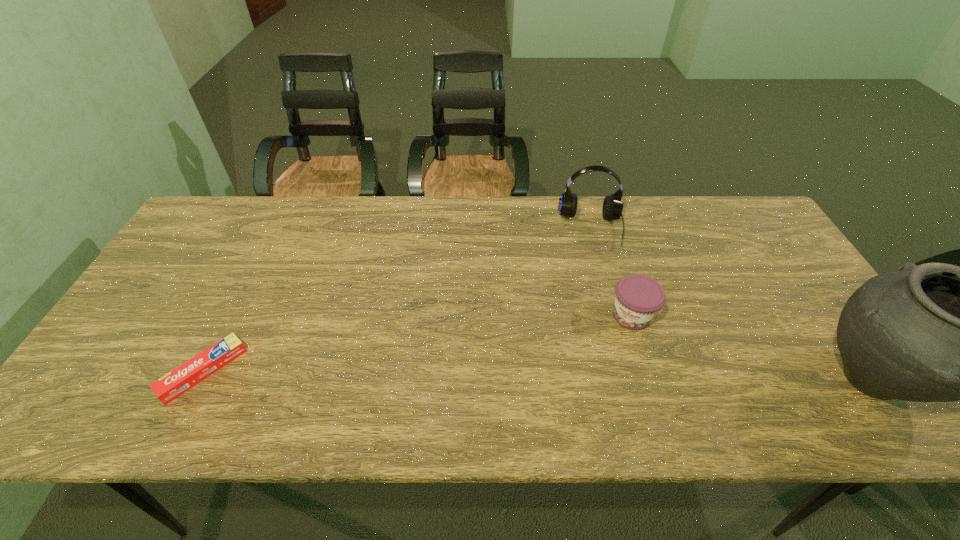
This screenshot has height=540, width=960. I want to click on vacant area between the shortest object and the jam, so click(418, 343).

You are a GUI agent. You are given a task and a screenshot of the screen. Output one action in this format:
    pyautogui.click(x=<x>, y=<y>)
    Task: Click on the free space that is in between the toothpaste and the jam
    The height and width of the screenshot is (540, 960).
    Given the screenshot: What is the action you would take?
    pyautogui.click(x=418, y=343)

Identify the location of vacant area that lies between the leftmost object and the third shortest object. (397, 300).

Point out which object is positioned as the third nearest to the tallest object. Please provide its 2D coordinates. Your answer should be formatted as a tuple, i.e. [(x, y)], where the tuple contains the x and y coordinates of a point satisfying the conditions above.

[(178, 381)]

Choose which object is the nearest neighbor to the headset. Please provide its 2D coordinates. Your answer should be formatted as a tuple, i.e. [(x, y)], where the tuple contains the x and y coordinates of a point satisfying the conditions above.

[(638, 298)]